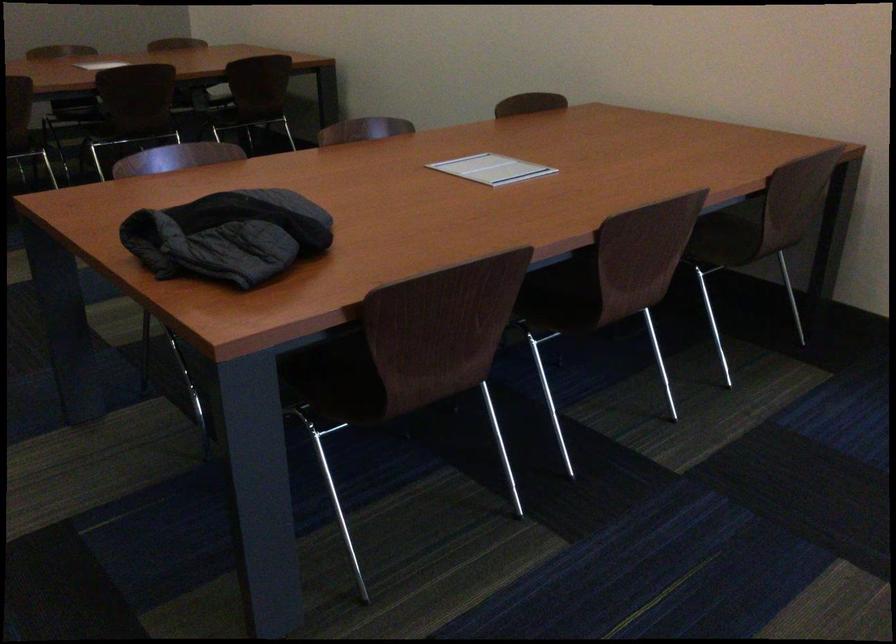
Find where to lift the dark quilted jacket. Please return your answer as a coordinate pair (x, y).

(228, 236)